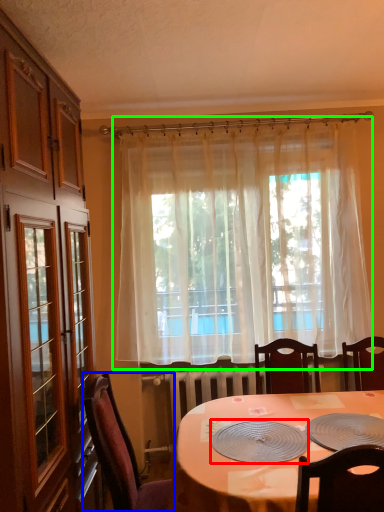
Question: Based on their relative distances, which object is farther from platter (highlighted by a red box)? Choose from chair (highlighted by a blue box) and curtain (highlighted by a green box).

Choices:
 (A) chair
 (B) curtain

Answer: (B)